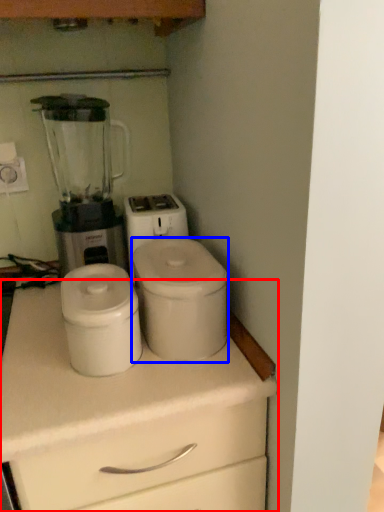
Question: Which point is further to the camera, chest of drawers (highlighted by a red box) or appliance (highlighted by a blue box)?

Choices:
 (A) chest of drawers
 (B) appliance

Answer: (B)